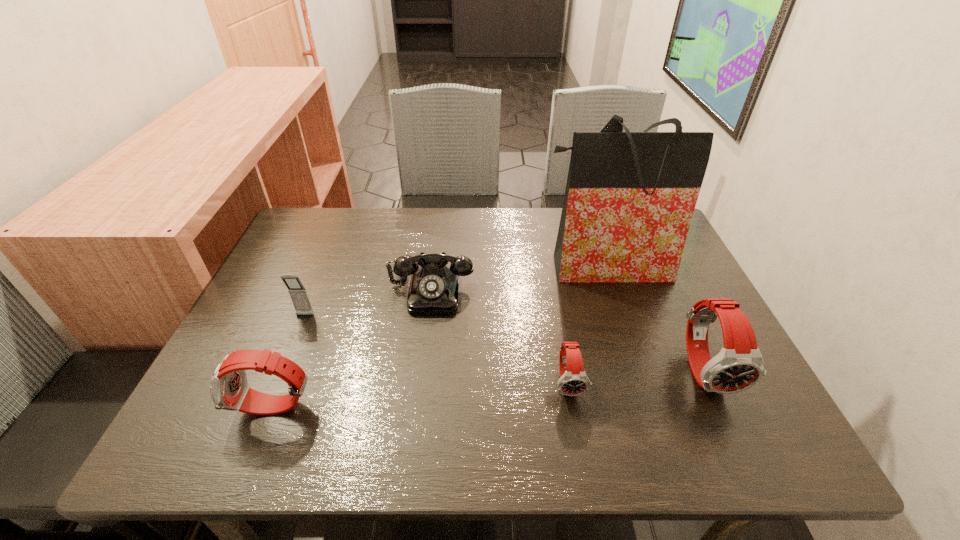
Where is `blank space at the near edge of the desktop`? blank space at the near edge of the desktop is located at coordinates [x=394, y=387].

The height and width of the screenshot is (540, 960). In order to click on vacant space at the left edge in this screenshot , I will do `click(278, 258)`.

I want to click on vacant space at the right edge, so click(664, 312).

Where is `vacant space at the far left corner of the desktop`? Image resolution: width=960 pixels, height=540 pixels. vacant space at the far left corner of the desktop is located at coordinates (324, 232).

This screenshot has width=960, height=540. I want to click on unoccupied position between the shortest watch and the leftmost watch, so click(421, 395).

Find the location of a particular element. The width and height of the screenshot is (960, 540). vacant point located between the rightmost watch and the telephone is located at coordinates (568, 330).

The width and height of the screenshot is (960, 540). Identify the location of empty space that is in between the leftmost watch and the rightmost watch. (490, 389).

Identify the location of free space between the rightmost watch and the cellular telephone. The image size is (960, 540). (505, 343).

Image resolution: width=960 pixels, height=540 pixels. I want to click on free space between the shortest watch and the third object from left to right, so click(500, 336).

Locate an element on the screen. unoccupied area between the second tallest watch and the shortest watch is located at coordinates (421, 395).